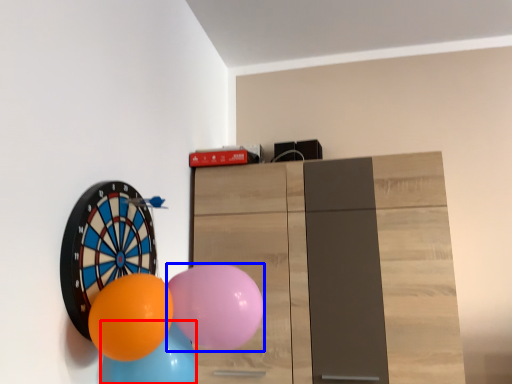
Question: Among these objects, which one is farthest to the camera, balloon (highlighted by a red box) or balloon (highlighted by a blue box)?

Choices:
 (A) balloon
 (B) balloon

Answer: (A)